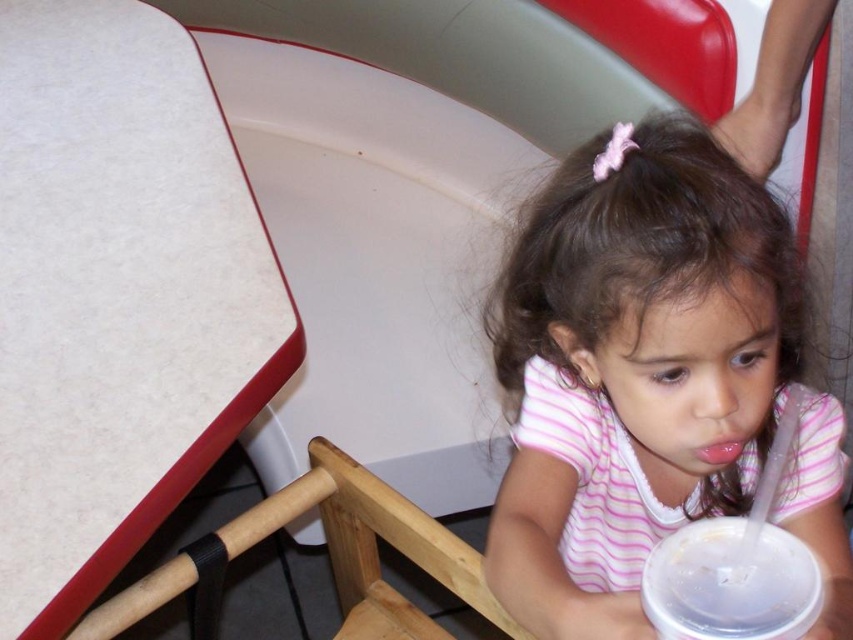
Between white laminate table at upper left and clear plastic cup at lower right, which one has less height?

With less height is clear plastic cup at lower right.

Is white laminate table at upper left to the right of clear plastic cup at lower right from the viewer's perspective?

No, white laminate table at upper left is not to the right of clear plastic cup at lower right.

I want to click on white laminate table at upper left, so click(x=115, y=296).

Which of these two, pink striped shirt at center or wooden chair at lower center, stands shorter?

Standing shorter between the two is wooden chair at lower center.

In order to click on pink striped shirt at center in this screenshot , I will do `click(634, 368)`.

Is white laminate table at upper left further to the viewer compared to pink striped shirt at center?

Yes, white laminate table at upper left is behind pink striped shirt at center.

Who is more forward, (126, 232) or (699, 408)?

Point (699, 408)

Where is `white laminate table at upper left`? The width and height of the screenshot is (853, 640). white laminate table at upper left is located at coordinates (115, 296).